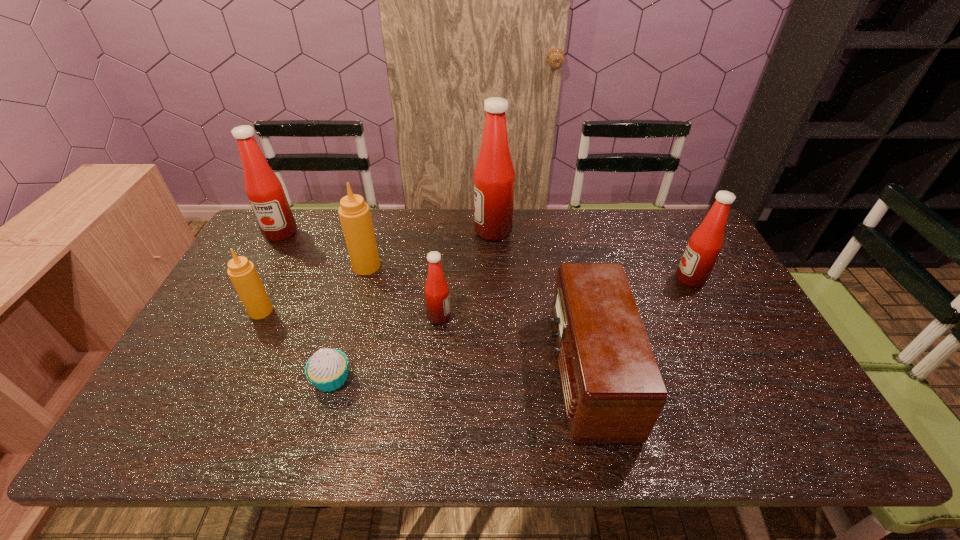
At what (x,y) coordinates should I click in order to perform the action: click on the smallest red condiment. Please return your answer as a coordinate pair (x, y). The width and height of the screenshot is (960, 540). Looking at the image, I should click on (437, 296).

Find the location of a particular element. The width and height of the screenshot is (960, 540). the third red condiment from right to left is located at coordinates (437, 296).

In order to click on the second object from right to left in this screenshot , I will do `click(613, 390)`.

The width and height of the screenshot is (960, 540). What are the coordinates of `white cupcake` in the screenshot? It's located at (327, 369).

This screenshot has height=540, width=960. What are the coordinates of `cupcake` in the screenshot? It's located at (327, 369).

In order to click on vacant space situated 0.050m on the front-facing side of the third object from right to left in this screenshot , I will do `click(460, 231)`.

You are a GUI agent. You are given a task and a screenshot of the screen. Output one action in this format:
    pyautogui.click(x=<x>, y=<y>)
    Task: Click on the vacant space positioned on the front-facing side of the third object from right to left
    The image size is (960, 540).
    Given the screenshot: What is the action you would take?
    pyautogui.click(x=411, y=231)

Where is `free location located on the front-facing side of the third object from right to left`? This screenshot has width=960, height=540. free location located on the front-facing side of the third object from right to left is located at coordinates (445, 231).

Where is `free space located on the front-facing side of the second tallest condiment`? This screenshot has height=540, width=960. free space located on the front-facing side of the second tallest condiment is located at coordinates (256, 278).

This screenshot has height=540, width=960. In order to click on vacant space situated 0.340m on the front of the right tan condiment in this screenshot , I will do `click(338, 367)`.